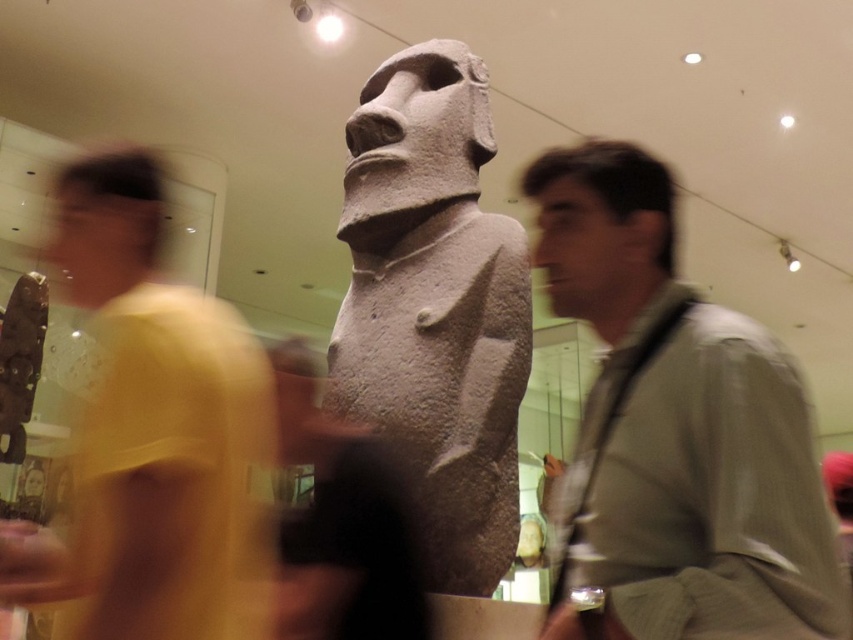
Question: Which of the following is the closest to the observer?

Choices:
 (A) light brown leather jacket at center
 (B) gray stone statue at center

Answer: (A)

Question: Considering the real-world distances, which object is closest to the light brown leather jacket at center?

Choices:
 (A) yellow matte shirt at left
 (B) gray stone statue at center

Answer: (B)

Question: Is yellow matte shirt at left closer to the viewer compared to gray stone statue at center?

Choices:
 (A) yes
 (B) no

Answer: (A)

Question: Can you confirm if light brown leather jacket at center is wider than yellow matte shirt at left?

Choices:
 (A) yes
 (B) no

Answer: (B)

Question: Which of the following is the farthest from the observer?

Choices:
 (A) gray stone statue at center
 (B) yellow matte shirt at left

Answer: (A)

Question: In this image, where is yellow matte shirt at left located relative to gray stone statue at center?

Choices:
 (A) right
 (B) left

Answer: (B)